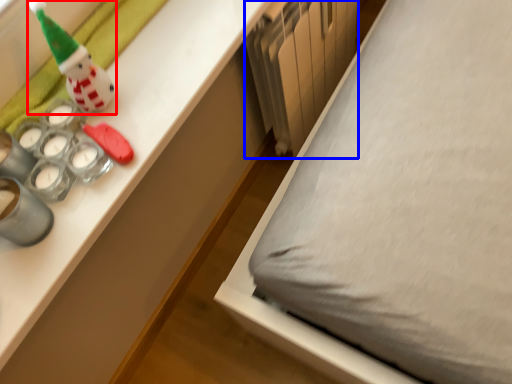
Question: Among these objects, which one is nearest to the camera, toy (highlighted by a red box) or radiator (highlighted by a blue box)?

Choices:
 (A) toy
 (B) radiator

Answer: (A)